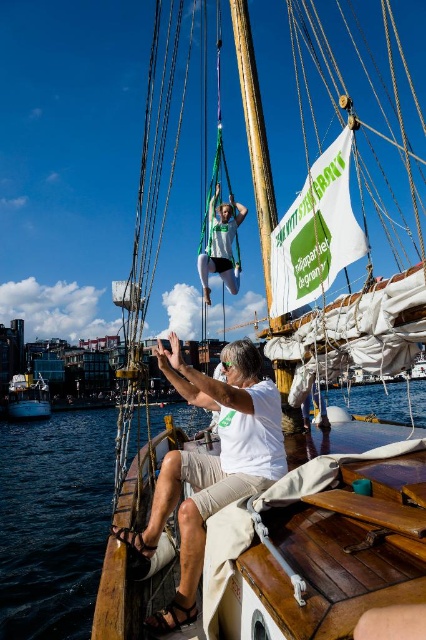
You are on a boat and see the blue water at lower left and the green fabric harness at center. Which object is positioned lower in the image?

The blue water at lower left is positioned below the green fabric harness at center, so it is lower in the image.

You are standing on the deck of the boat and want to point out the wooden mast at upper center and the blue water at lower left to a friend. Based on their positions, which object is located to the left when looking at the image?

The wooden mast at upper center is to the left of the blue water at lower left.